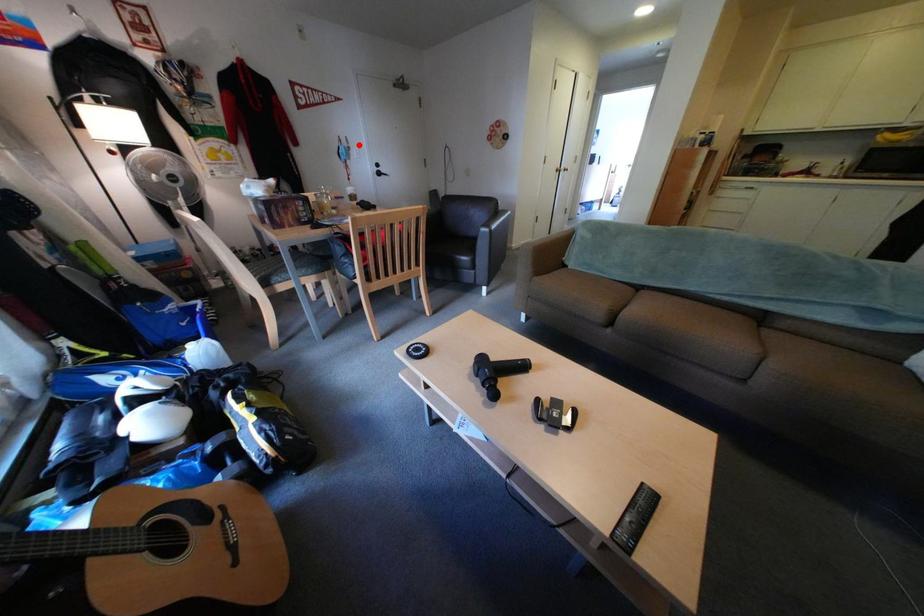
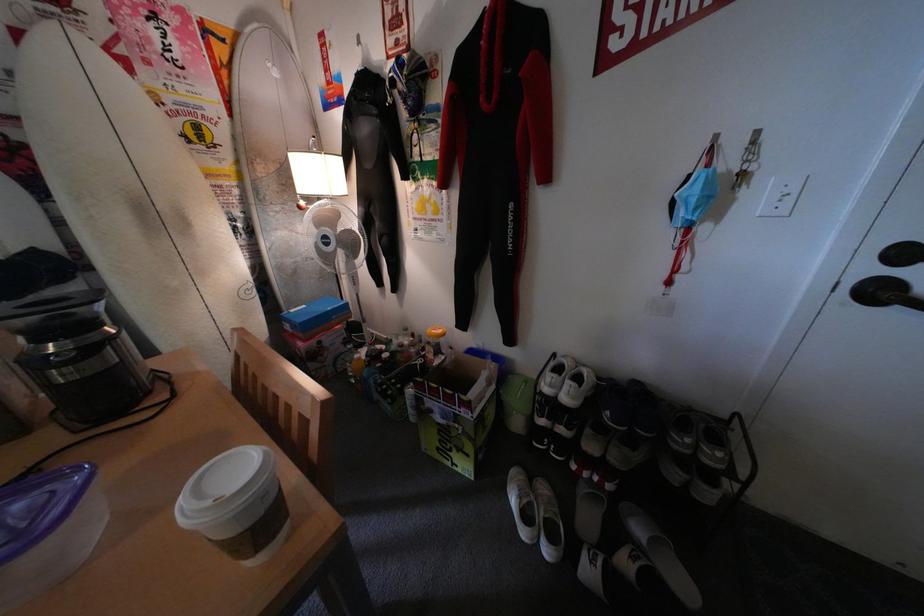
Question: I am providing you with two images of the same scene from different viewpoints. A red point is marked on the first image. Is the red point's position out of view in image 2?

Choices:
 (A) Yes
 (B) No

Answer: (B)